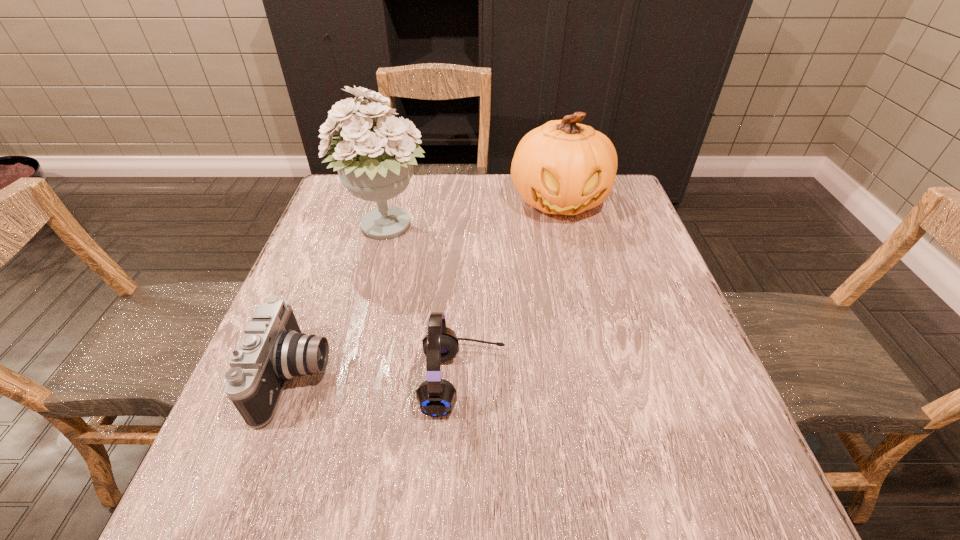
You are a GUI agent. You are given a task and a screenshot of the screen. Output one action in this format:
    pyautogui.click(x=<x>, y=<y>)
    Task: Click on the tallest object
    The height and width of the screenshot is (540, 960).
    Given the screenshot: What is the action you would take?
    pyautogui.click(x=376, y=165)

Where is `pumpkin`? The width and height of the screenshot is (960, 540). pumpkin is located at coordinates (562, 167).

Where is `the rightmost object`? This screenshot has width=960, height=540. the rightmost object is located at coordinates (562, 167).

Where is `the third object from left to right`? The image size is (960, 540). the third object from left to right is located at coordinates (437, 397).

Identify the location of camera. The width and height of the screenshot is (960, 540). (273, 350).

At what (x,y) coordinates should I click in order to perform the action: click on vacant area situated on the front of the bouquet. Please return your answer as a coordinate pair (x, y). The height and width of the screenshot is (540, 960). Looking at the image, I should click on point(352,360).

This screenshot has height=540, width=960. What are the coordinates of `blank space located on the front face of the rightmost object` in the screenshot? It's located at (588, 319).

The width and height of the screenshot is (960, 540). What are the coordinates of `vacant space positioned on the ear cushions of the headset` in the screenshot? It's located at (598, 381).

In order to click on vacant space located 0.340m on the front-facing side of the camera in this screenshot , I will do `click(509, 376)`.

This screenshot has height=540, width=960. In order to click on bouquet located in the far edge section of the desktop in this screenshot , I will do `click(376, 165)`.